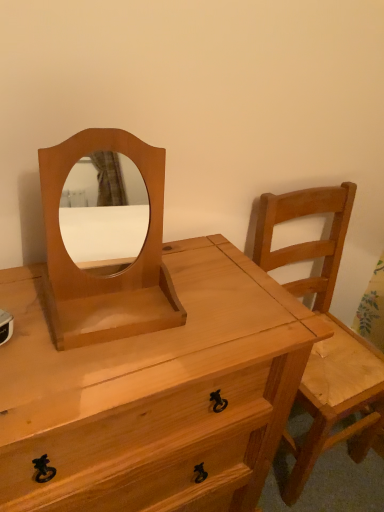
This screenshot has width=384, height=512. I want to click on vacant space positioned to the left of light brown wood mirror at center, so click(x=24, y=297).